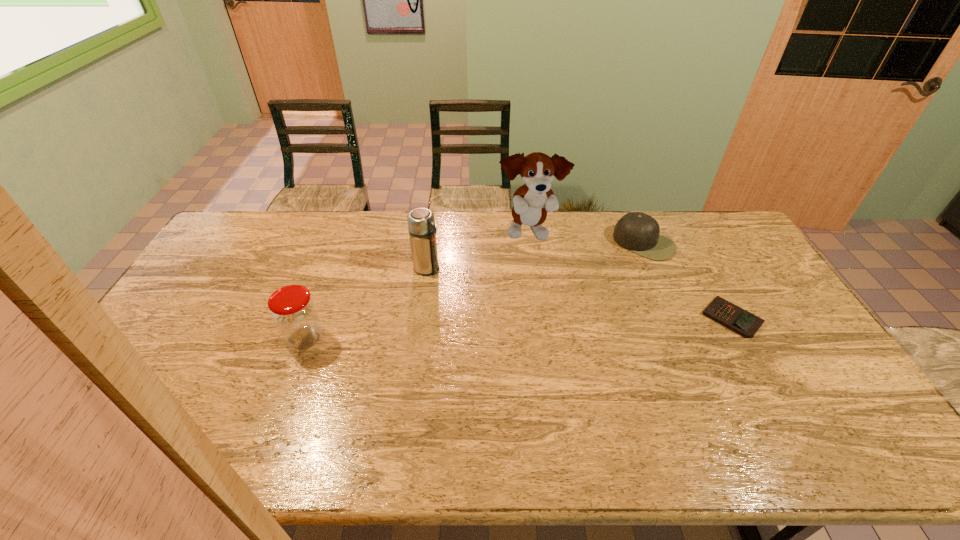
Find the location of a particular element. free region located on the brim of the second shortest object is located at coordinates (584, 319).

Image resolution: width=960 pixels, height=540 pixels. In order to click on vacant space located 0.080m on the brim of the second shortest object in this screenshot , I will do `click(622, 270)`.

Find the location of a particular element. The height and width of the screenshot is (540, 960). free space located 0.370m on the brim of the second shortest object is located at coordinates (582, 321).

I want to click on vacant region located with a handle on the side of the fourth shortest object, so click(x=498, y=319).

Find the location of a particular element. blank space located with a handle on the side of the fourth shortest object is located at coordinates [492, 313].

You are a GUI agent. You are given a task and a screenshot of the screen. Output one action in this format:
    pyautogui.click(x=<x>, y=<y>)
    Task: Click on the free space located 0.140m with a handle on the side of the fourth shortest object
    The height and width of the screenshot is (540, 960).
    Given the screenshot: What is the action you would take?
    pyautogui.click(x=466, y=295)

Where is `vacant space situated 0.260m on the face of the third object from right to left`? This screenshot has height=540, width=960. vacant space situated 0.260m on the face of the third object from right to left is located at coordinates (573, 303).

The image size is (960, 540). I want to click on vacant space located 0.080m on the face of the third object from right to left, so click(551, 267).

The width and height of the screenshot is (960, 540). Find the location of `vacant position located 0.070m on the face of the third object from right to left`. vacant position located 0.070m on the face of the third object from right to left is located at coordinates (550, 265).

At what (x,y) coordinates should I click in order to perform the action: click on cap positioned at the far edge. Please return your answer as a coordinate pair (x, y). Image resolution: width=960 pixels, height=540 pixels. Looking at the image, I should click on (636, 231).